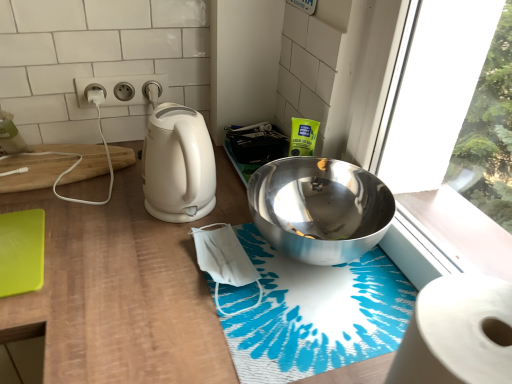
The image size is (512, 384). In order to click on free space above wooden cutting board at left, positioned as the second cutting board in bottom-to-top order (from a real-world perspective) in this screenshot , I will do `click(72, 157)`.